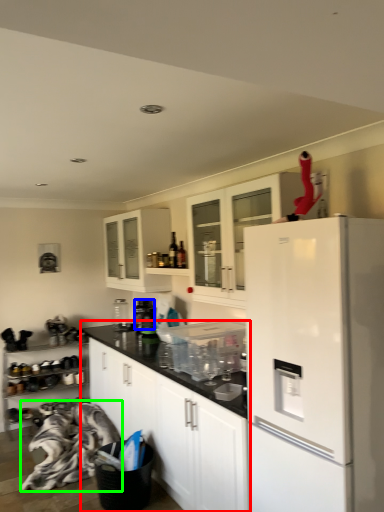
Question: Which object is positioned farthest from cabinetry (highlighted by a red box)? Select from appliance (highlighted by a blue box) and material (highlighted by a green box).

Choices:
 (A) appliance
 (B) material

Answer: (A)